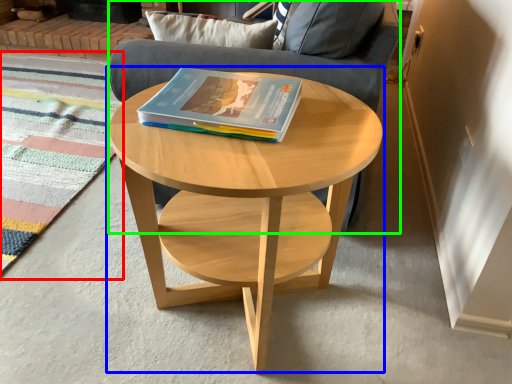
Question: Which object is positioned farthest from mat (highlighted by a red box)? Select from coffee table (highlighted by a blue box) and armchair (highlighted by a green box).

Choices:
 (A) coffee table
 (B) armchair

Answer: (A)